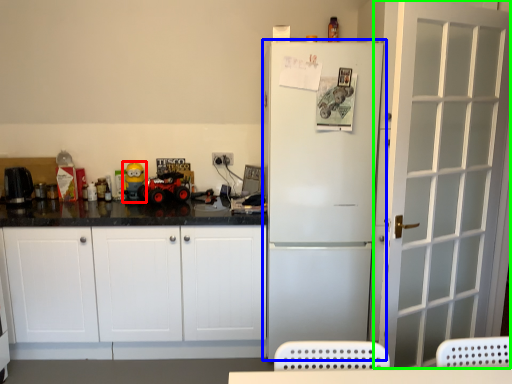
Question: Considering the real-world distances, which object is closest to toy (highlighted by a red box)? refrigerator (highlighted by a blue box) or door (highlighted by a green box).

Choices:
 (A) refrigerator
 (B) door

Answer: (A)